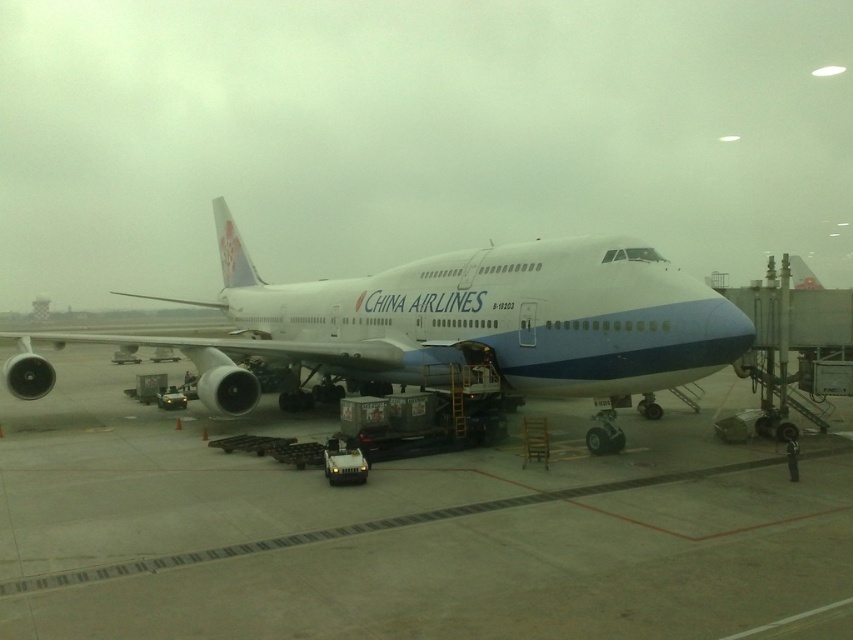
You are a pilot standing on the smooth concrete tarmac at center. You need to board passengers into the white glossy airplane at center. Which direction should you walk to reach the airplane?

The smooth concrete tarmac at center is positioned under the white glossy airplane at center, so you should walk towards the airplane as it is directly above the tarmac.

You are a pilot who needs to ensure the jet bridge is positioned correctly for boarding. Based on the image, which object is lower in height between the smooth concrete tarmac at center and the white glossy airplane at center?

The smooth concrete tarmac at center is not as tall as the white glossy airplane at center, so the smooth concrete tarmac at center is lower in height.

You are standing at the airport gate looking at the China Airlines Boeing 747. There are two points marked on the image. The first point is at coordinate point [646,449] and the second point is at coordinate point [648,264]. Which point is closer to you?

Point [646,449] is further to the viewer than point [648,264], so the second point is closer to you.